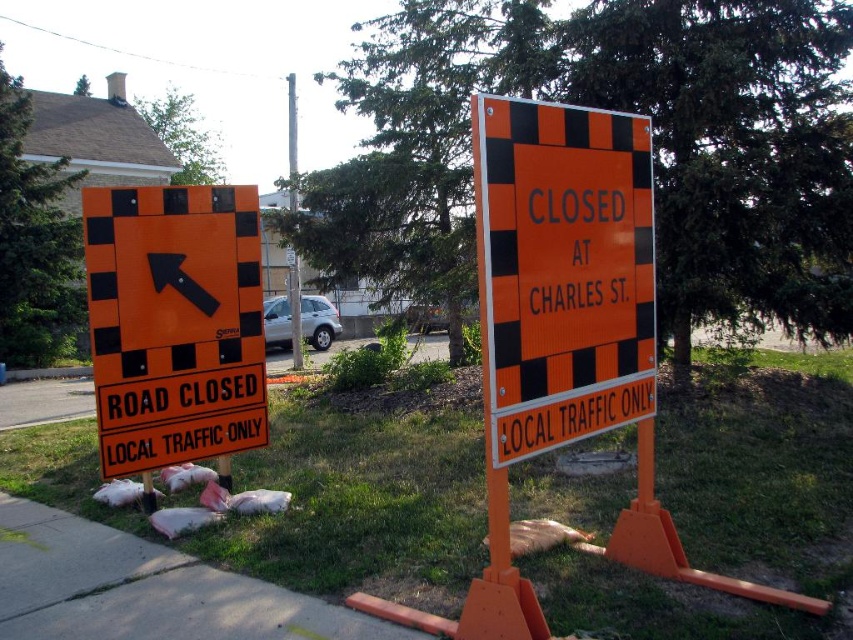
You are a pedestrian standing at the point marked by the coordinate point (x=173, y=323). You want to walk to the sidewalk. Which direction should you head to reach the sidewalk?

The point (x=173, y=323) marks the orange reflective road sign at left, which is positioned near the sidewalk. To reach the sidewalk, you should walk towards the direction away from the road closed signs towards the sidewalk area.

You are a drone operator trying to capture aerial footage of two points marked on the ground. The points are labeled as point (254,228) and point (291,257). Based on the scene description, which point should you focus on first to ensure it appears larger in the footage?

Point (254,228) is closer to the camera than point (291,257), so focusing on point (254,228) first will make it appear larger in the footage.